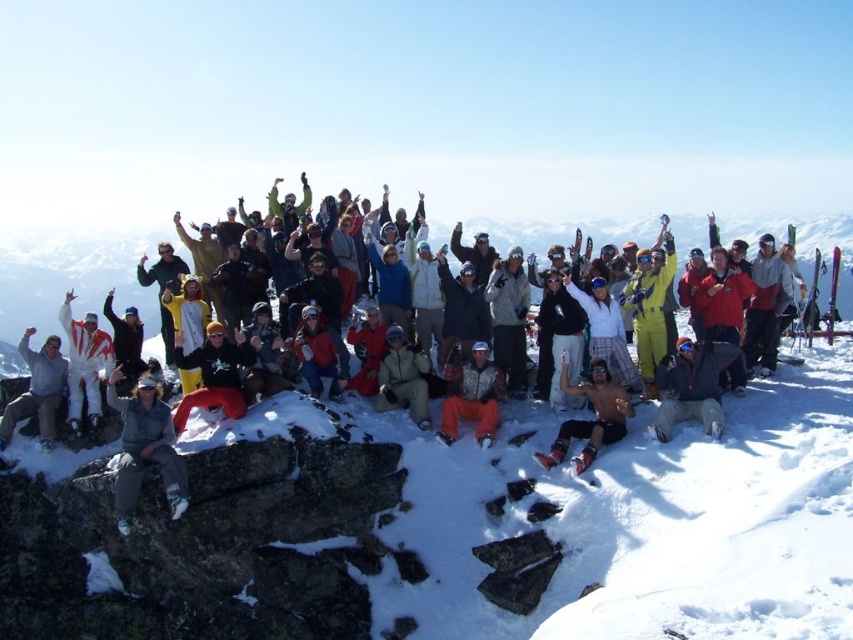
You are a photographer trying to capture a photo of the group. You want to ensure that both the gray fleece jacket at lower left and the camouflage pants at center are visible in the frame. Based on their positions, which object is closer to the bottom edge of the photo?

The gray fleece jacket at lower left is located below camouflage pants at center, so it is closer to the bottom edge of the photo.

You are standing on the snowy mountain peak and want to move from the point at coordinates point (177, 481) to the point at coordinates point (474, 420). Which direction should you face to walk towards the second point?

Since point (177, 481) is closer to the viewer than point (474, 420), you should face away from the viewer to walk towards the point (474, 420).